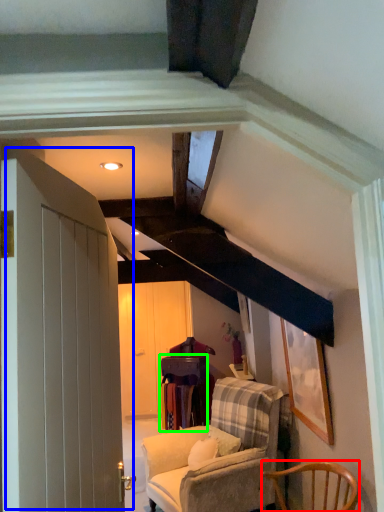
Question: Considering the real-world distances, which object is farthest from chair (highlighted by a red box)? door (highlighted by a blue box) or table (highlighted by a green box)?

Choices:
 (A) door
 (B) table

Answer: (B)